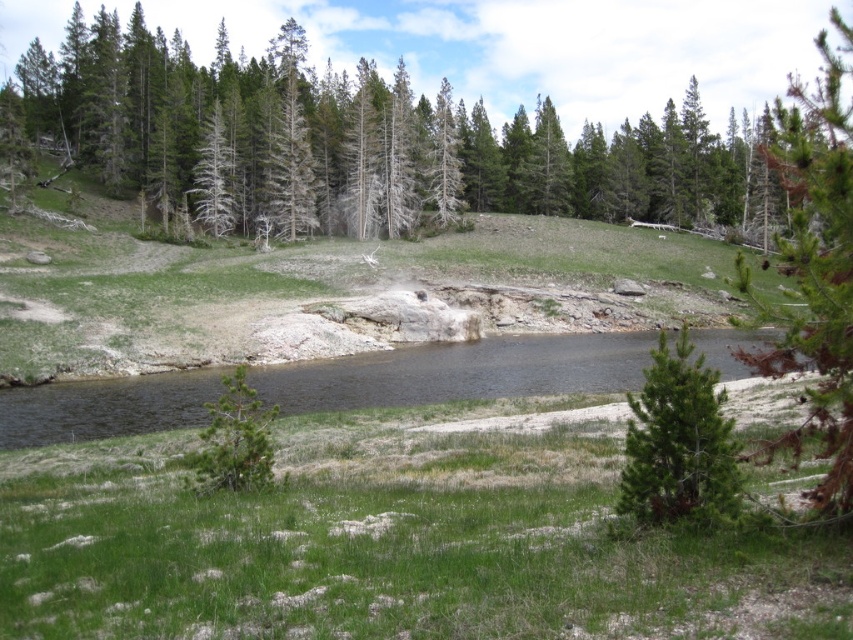
You are standing at the edge of the scene and want to cross to the opposite side. The dark brown water at center is in your path. Can you safely walk across the water? Please explain your reasoning based on the scene description.

The dark brown water at center is 93.71 feet away from the viewer. Since the water is a body of water and not solid ground, you cannot safely walk across it. You would need to find an alternative path around the water to reach the opposite side safely.

You are standing at the edge of the water in the scene and want to walk to the green textured tree at upper center. The green grassy hillside at center is in your path. How far will you have to walk to reach the tree?

The green grassy hillside at center is 151.77 feet away from the green textured tree at upper center. Therefore, you will have to walk approximately 151.77 feet to reach the tree.

You are standing at the center of the grassy area and see the point marked at point [459,372]. What is located at that point?

At point [459,372] lies dark brown water at center.